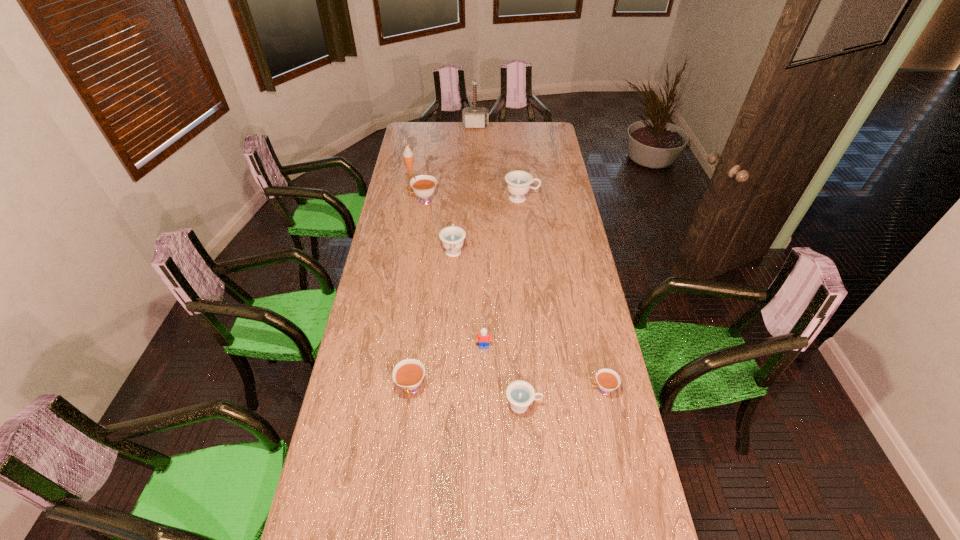
Where is `the second biggest white teacup`? The width and height of the screenshot is (960, 540). the second biggest white teacup is located at coordinates (408, 374).

Identify the location of the smallest blue teacup. This screenshot has width=960, height=540. (520, 394).

The image size is (960, 540). I want to click on the rightmost teacup, so click(608, 380).

You are a GUI agent. You are given a task and a screenshot of the screen. Output one action in this format:
    pyautogui.click(x=<x>, y=<y>)
    Task: Click on the rightmost object
    Image resolution: width=960 pixels, height=540 pixels.
    Given the screenshot: What is the action you would take?
    pyautogui.click(x=608, y=380)

Find the location of a particular element. The width and height of the screenshot is (960, 540). vacant region located for striking with the head of the hammer is located at coordinates (475, 143).

In order to click on vacant position located on the right of the leftmost object in this screenshot , I will do `click(475, 167)`.

Locate an element on the screen. The width and height of the screenshot is (960, 540). vacant area situated on the side of the biggest blue teacup with the handle is located at coordinates (549, 199).

At what (x,y) coordinates should I click in order to perform the action: click on vacant space located on the side of the farthest white teacup with the handle. Please return your answer as a coordinate pair (x, y). The width and height of the screenshot is (960, 540). Looking at the image, I should click on (387, 201).

Locate an element on the screen. The image size is (960, 540). free region located 0.290m on the side of the fourth nearest teacup with the handle is located at coordinates (457, 200).

This screenshot has width=960, height=540. What are the coordinates of `vacant region located on the side of the fourth nearest teacup with the handle` in the screenshot? It's located at (456, 215).